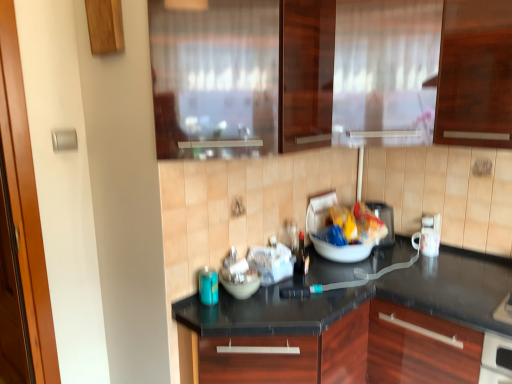
At what (x,y) coordinates should I click in order to perform the action: click on free space in front of white glossy bowl at center. Please return your answer as a coordinate pair (x, y). This screenshot has height=384, width=512. Looking at the image, I should click on (247, 312).